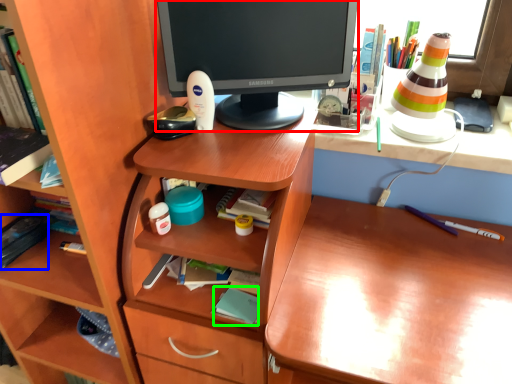
Question: Which object is positioned farthest from computer monitor (highlighted by a red box)? Select from book (highlighted by a blue box) and book (highlighted by a green box).

Choices:
 (A) book
 (B) book

Answer: (A)